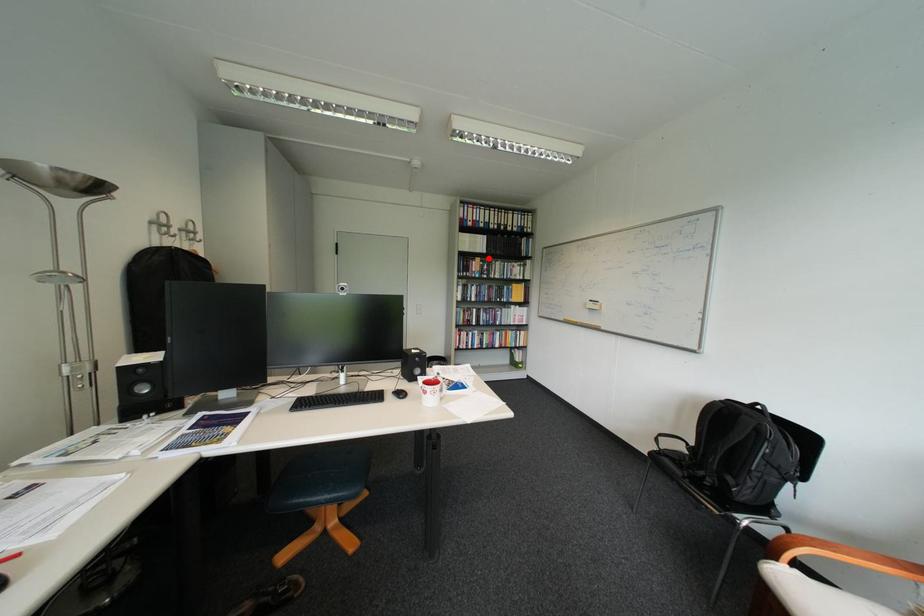
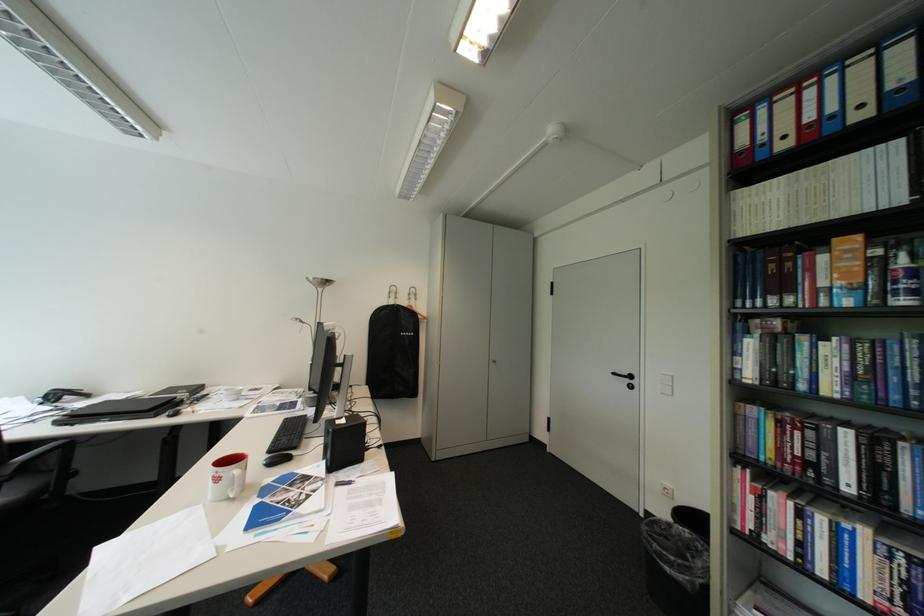
Find the pixel in the second image that matches the highlighted location in the first image.

(848, 240)